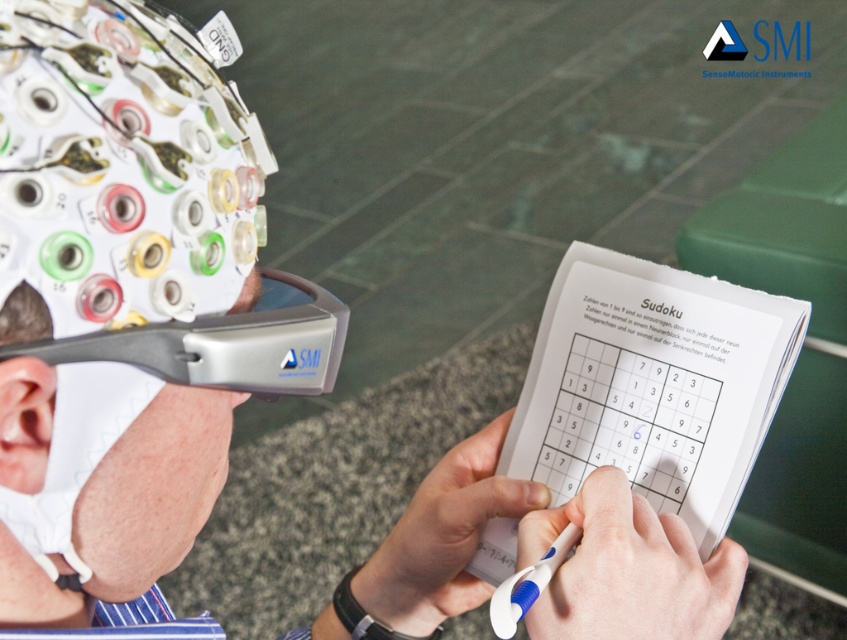
You are a researcher in a lab and need to adjust the equipment on the person. The matte gray helmet at upper left and the silver metallic goggles at upper left are both on the left side. Which one is closer to the center of the image?

The matte gray helmet at upper left is to the right of the silver metallic goggles at upper left, so the matte gray helmet at upper left is closer to the center of the image.

You are a researcher in a lab setting. You need to place both the matte gray helmet at upper left and the silver metallic goggles at upper left onto a shelf that can only hold items with a combined width of 40 cm. Given their sizes, can both items fit together on the shelf?

The matte gray helmet at upper left is wider than the silver metallic goggles at upper left. Since their combined width must be less than or equal to 40 cm, but we don not know their exact widths, it is impossible to determine if they will fit together on the shelf without additional information.